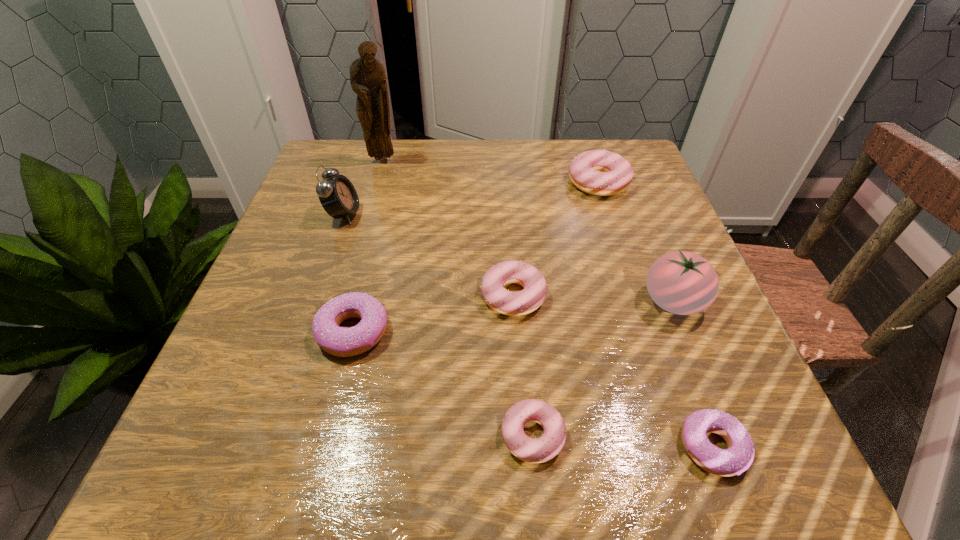
Where is `pink doughnut that stands as the second closest to the alarm clock`? The width and height of the screenshot is (960, 540). pink doughnut that stands as the second closest to the alarm clock is located at coordinates (598, 172).

Where is `vacant region that satisfies the following two spatial constraints: 1. on the front-facing side of the figurine; 2. on the left side of the red tomato`? vacant region that satisfies the following two spatial constraints: 1. on the front-facing side of the figurine; 2. on the left side of the red tomato is located at coordinates coord(343,301).

Identify the location of vacant space that satisfies the following two spatial constraints: 1. on the front side of the smaller purple doughnut; 2. on the left side of the second nearest pink doughnut. (523, 444).

Find the location of a particular element. The height and width of the screenshot is (540, 960). free space in the image that satisfies the following two spatial constraints: 1. on the face of the white alarm clock; 2. on the right side of the red tomato is located at coordinates (314, 301).

At what (x,y) coordinates should I click in order to perform the action: click on free location that satisfies the following two spatial constraints: 1. on the face of the nearest pink doughnut; 2. on the left side of the white alarm clock. Please return your answer as a coordinate pair (x, y). This screenshot has height=540, width=960. Looking at the image, I should click on (268, 435).

Where is `vacant space that satisfies the following two spatial constraints: 1. on the face of the white alarm clock; 2. on the back side of the tomato`? vacant space that satisfies the following two spatial constraints: 1. on the face of the white alarm clock; 2. on the back side of the tomato is located at coordinates (314, 301).

The width and height of the screenshot is (960, 540). What are the coordinates of `free space that satisfies the following two spatial constraints: 1. on the back side of the red tomato; 2. on the right side of the left purple doughnut` in the screenshot? It's located at (361, 301).